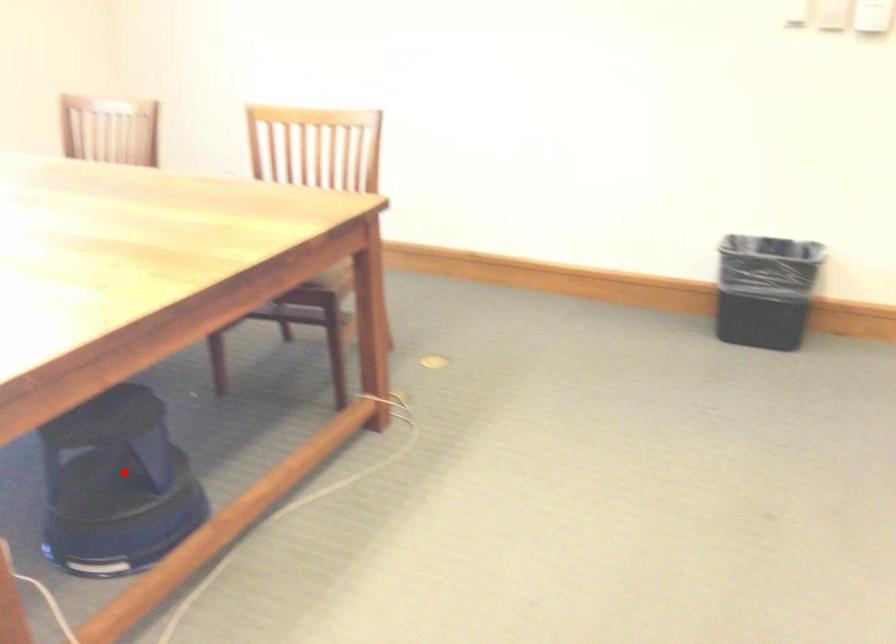
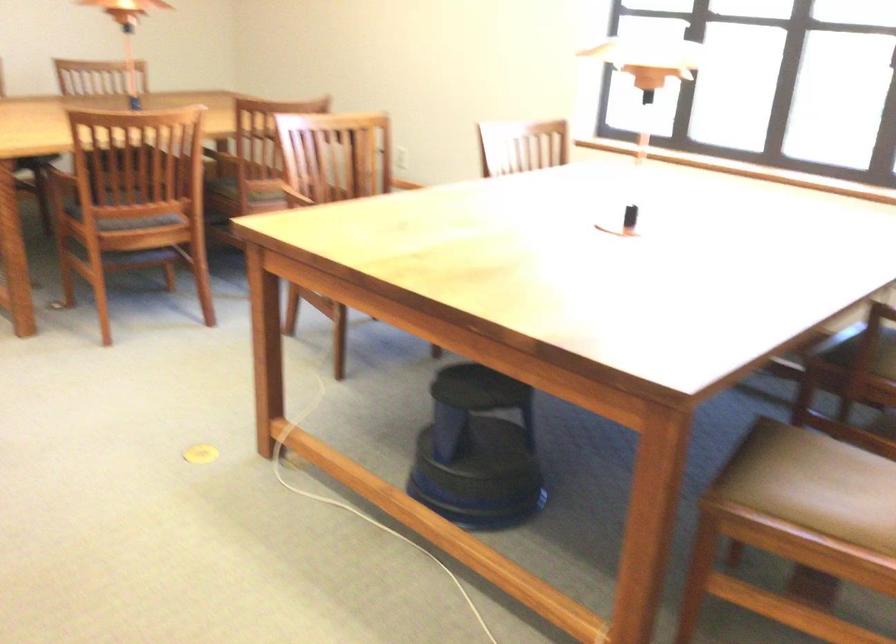
Question: I am providing you with two images of the same scene from different viewpoints. A red point is shown in image1. For the corresponding object point in image2, is it positioned nearer or farther from the camera?

Choices:
 (A) Nearer
 (B) Farther

Answer: (B)